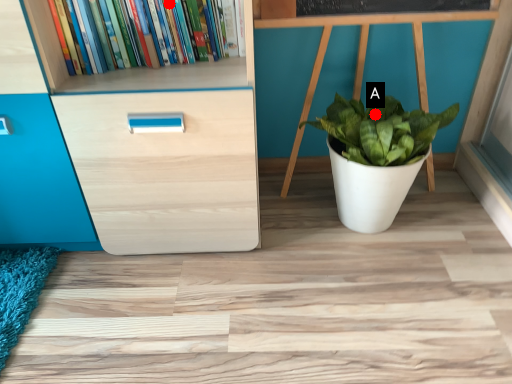
Question: Two points are circled on the image, labeled by A and B beside each circle. Among these points, which one is nearest to the camera?

Choices:
 (A) A is closer
 (B) B is closer

Answer: (B)